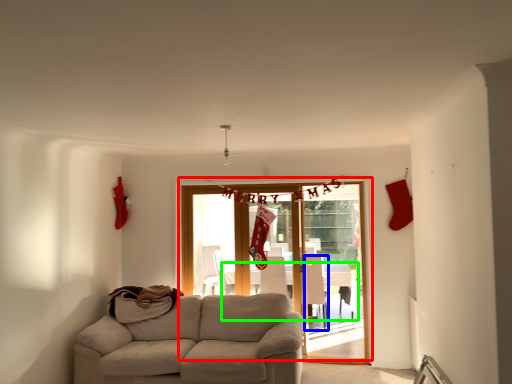
Question: Which is farther away from door (highlighted by a red box)? armchair (highlighted by a blue box) or table (highlighted by a green box)?

Choices:
 (A) armchair
 (B) table

Answer: (B)